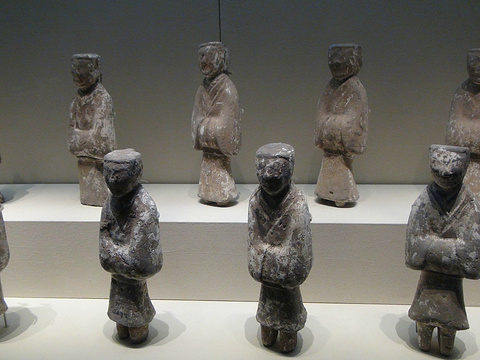
Locate an element on the screen. Image resolution: width=480 pixels, height=360 pixels. seam in wall is located at coordinates (220, 29).